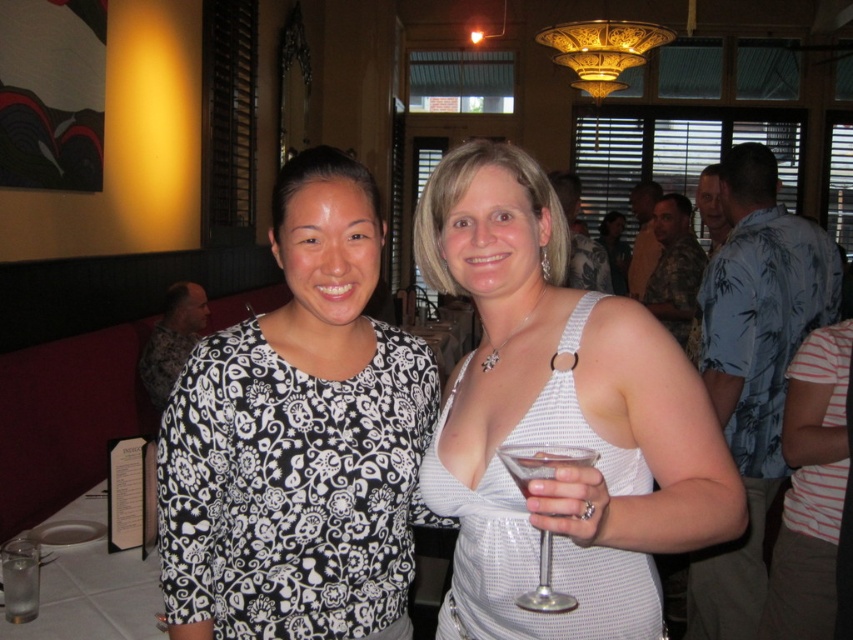
You are a photographer trying to focus on both the black printed blouse at center and the clear glass martini glass at center in the image. Which object is closer to the camera?

The black printed blouse at center is closer to the camera than the clear glass martini glass at center.

You are a bartender preparing drinks for a party. You have two clear glasses in front of you, a clear glass martini glass at center and a clear glass at lower left. Which glass is located to the right of the other?

The clear glass martini glass at center is positioned on the right side of clear glass at lower left.